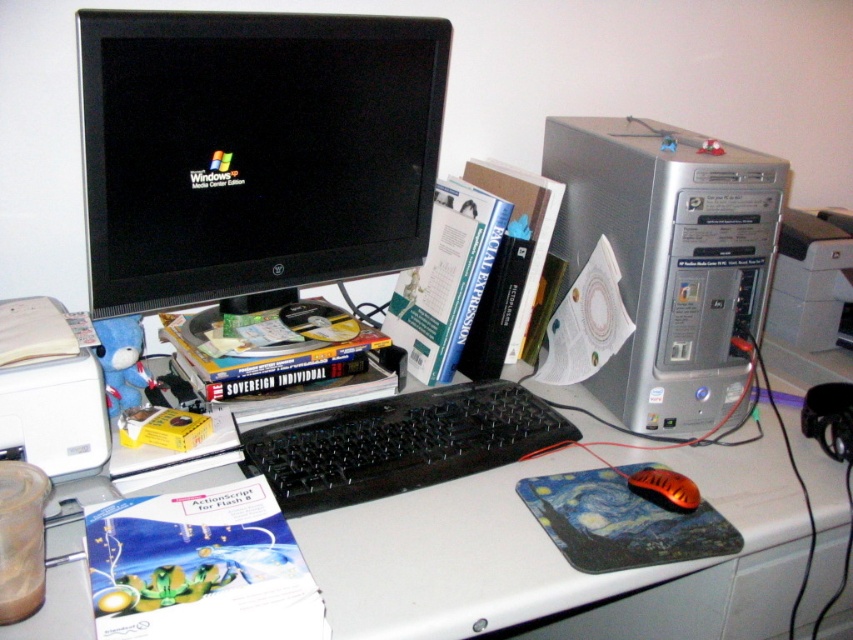
Question: Among these points, which one is nearest to the camera?

Choices:
 (A) (611, 131)
 (B) (32, 353)

Answer: (B)

Question: Which point is farther to the camera?

Choices:
 (A) orange matte mouse at lower right
 (B) black glossy monitor at upper left
 (C) silver metallic printer at right

Answer: (C)

Question: Is black glossy monitor at upper left wider than white plastic computer desk at center?

Choices:
 (A) yes
 (B) no

Answer: (B)

Question: Is silver metallic printer at right thinner than orange matte mouse at lower right?

Choices:
 (A) no
 (B) yes

Answer: (A)

Question: Is black plastic keyboard at center smaller than white matte printer at lower left?

Choices:
 (A) no
 (B) yes

Answer: (A)

Question: Which point is closer to the camera taking this photo?

Choices:
 (A) click(824, 324)
 (B) click(689, 497)

Answer: (B)